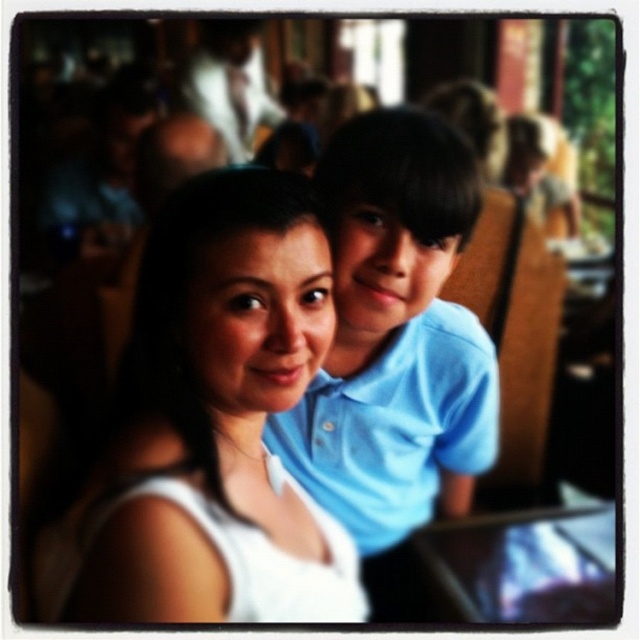
You are a photographer trying to capture a clear photo of both the blue cotton shirt at center and the metallic silver laptop at center. Given that your camera has a depth of field that can focus on objects within 8 inches, will both items be in focus?

The blue cotton shirt at center is 8.74 inches from the metallic silver laptop at center. Since the distance between them exceeds the camera sensor depth of field limit of 8 inches, only one of them will be in focus at a time.

You are taking a photo of two people. You notice the blue cotton shirt at center and the white fabric at upper center. Which one is closer to the camera?

The blue cotton shirt at center is closer to the camera because the white fabric at upper center is behind it.

You are taking a photo of two people sitting at a table. You notice the blue cotton shirt at center and the metallic silver laptop at center. Which object is positioned to the left of the other?

The blue cotton shirt at center is to the left of the metallic silver laptop at center.